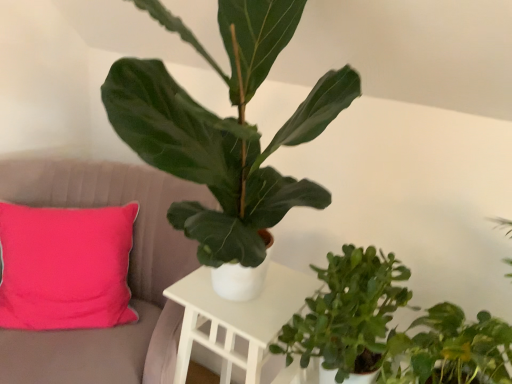
Question: From a real-world perspective, is pink fabric cushion at left above or below white matte table at center?

Choices:
 (A) above
 (B) below

Answer: (B)

Question: Based on their sizes in the image, would you say pink fabric cushion at left is bigger or smaller than white matte table at center?

Choices:
 (A) small
 (B) big

Answer: (B)

Question: Which object is positioned farthest from the green matte plant at center, the 1th houseplant from the top?

Choices:
 (A) green matte plant at center, which is the 2th houseplant in top-to-bottom order
 (B) pink fabric cushion at left
 (C) green matte plant at lower right, the 1th houseplant when ordered from bottom to top
 (D) white matte table at center

Answer: (B)

Question: Considering the real-world distances, which object is closest to the pink fabric cushion at left?

Choices:
 (A) white matte table at center
 (B) green matte plant at center, positioned as the third houseplant in bottom-to-top order
 (C) green matte plant at lower right, the 1th houseplant when ordered from bottom to top
 (D) green matte plant at center, acting as the second houseplant starting from the bottom

Answer: (A)